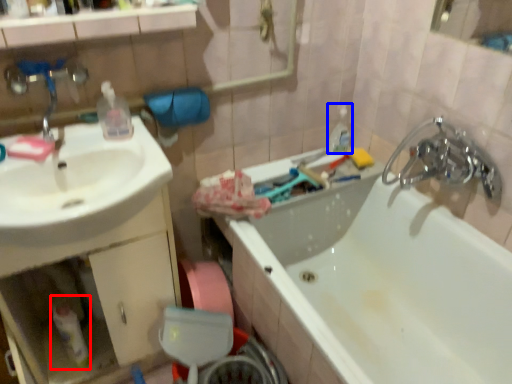
Question: Among these objects, which one is nearest to the camera, bottle (highlighted by a red box) or toiletry (highlighted by a blue box)?

Choices:
 (A) bottle
 (B) toiletry

Answer: (A)